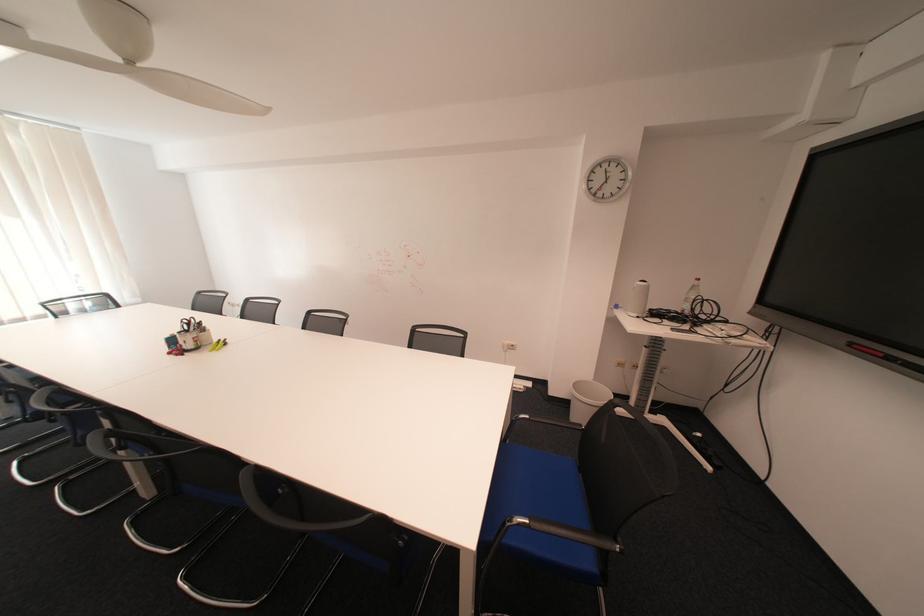
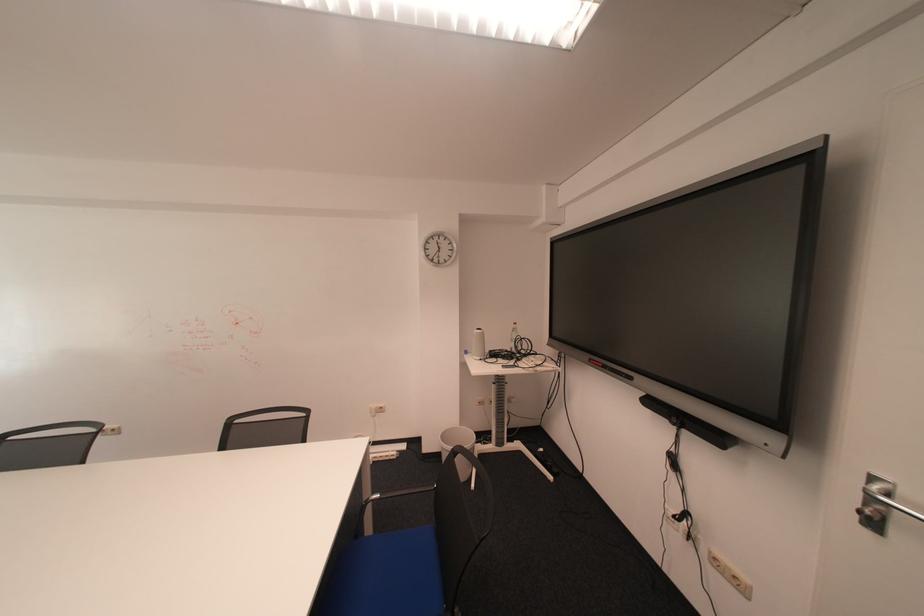
Locate, in the second image, the point that corresponds to point (626, 310) in the first image.

(477, 355)